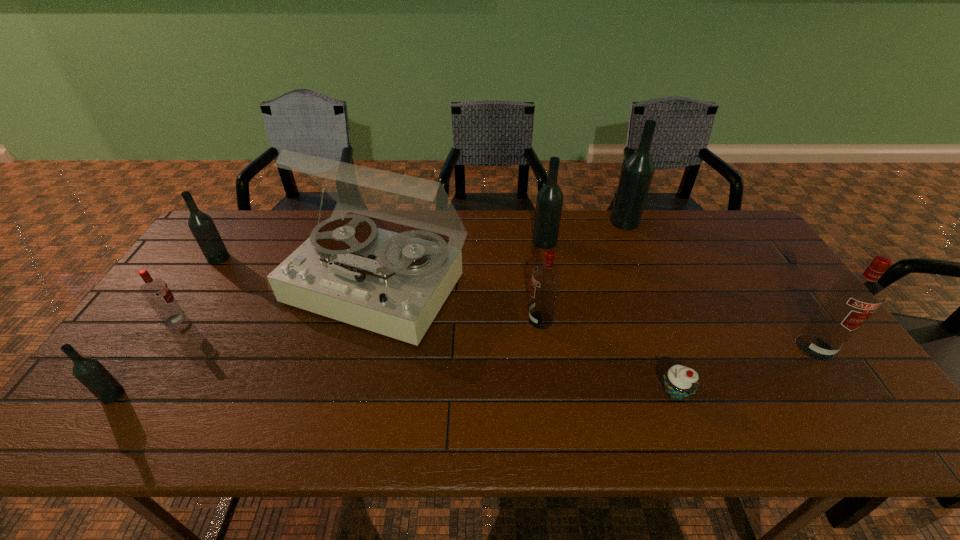
This screenshot has height=540, width=960. Identify the location of the second smallest red vodka. (546, 278).

This screenshot has height=540, width=960. In order to click on the leftmost red vodka in this screenshot , I will do click(x=157, y=293).

You are a GUI agent. You are given a task and a screenshot of the screen. Output one action in this format:
    pyautogui.click(x=<x>, y=<y>)
    Task: Click on the nearest black vodka
    
    Given the screenshot: What is the action you would take?
    pyautogui.click(x=90, y=372)

Locate an element on the screen. The width and height of the screenshot is (960, 540). the nearest vodka is located at coordinates (90, 372).

Identify the location of cupcake. (680, 382).

Where is `vacant space located on the front of the white record player`? This screenshot has width=960, height=540. vacant space located on the front of the white record player is located at coordinates (347, 412).

Image resolution: width=960 pixels, height=540 pixels. What are the coordinates of `vacant space situated on the right of the rightmost black vodka` in the screenshot? It's located at (702, 222).

What are the coordinates of `free spot located on the left of the second black vodka from right to left` in the screenshot? It's located at (475, 241).

This screenshot has width=960, height=540. Identify the location of free space located on the front label of the rightmost vodka. (863, 417).

You are a GUI agent. You are given a task and a screenshot of the screen. Output one action in this format:
    pyautogui.click(x=<x>, y=<y>)
    Task: Click on the free space located on the right of the second smallest black vodka
    The height and width of the screenshot is (540, 960).
    Given the screenshot: What is the action you would take?
    pyautogui.click(x=337, y=258)